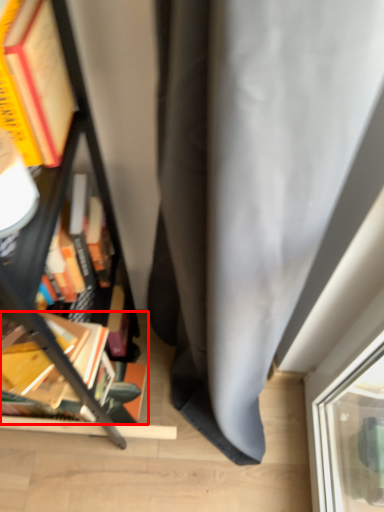
Question: From the image, what is the correct spatial relationship of book (annotated by the red box) in relation to bookcase?

Choices:
 (A) right
 (B) left

Answer: (A)